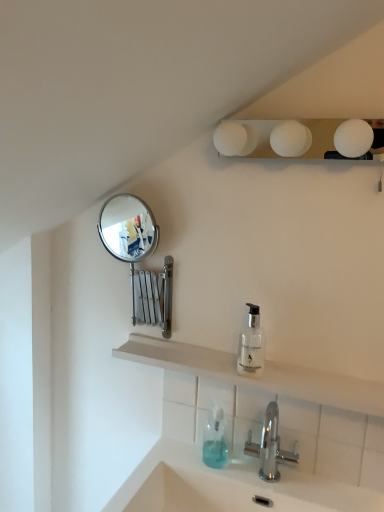
Where is `vacant space in white matte shelf at center (from a real-world perspective)`? The width and height of the screenshot is (384, 512). vacant space in white matte shelf at center (from a real-world perspective) is located at coordinates (244, 450).